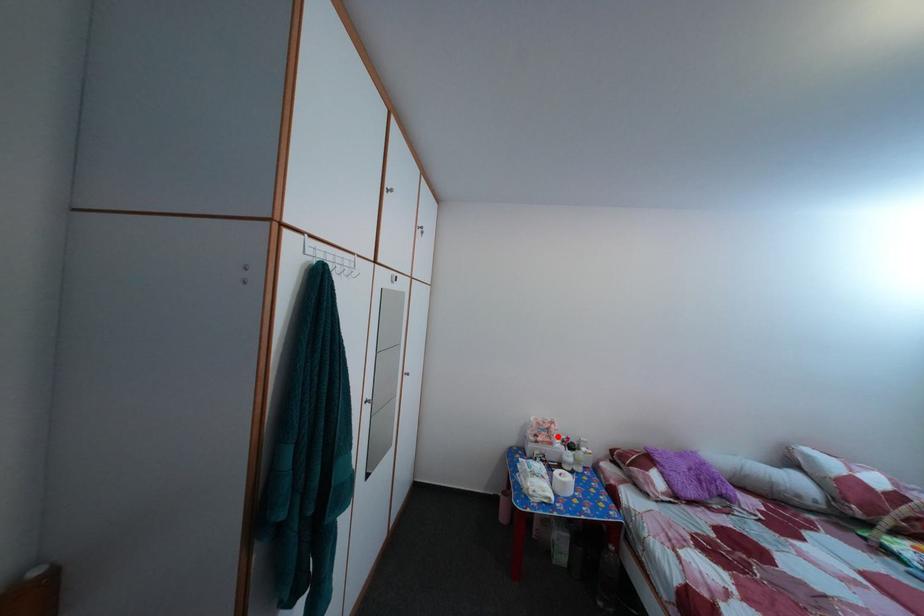
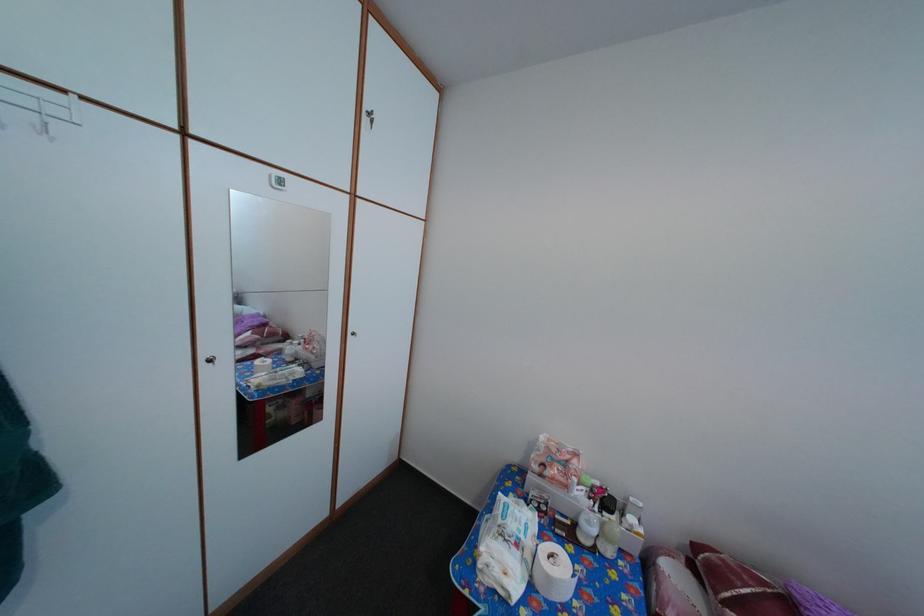
Find the pixel in the second image that matches the highlighted location in the first image.

(576, 469)